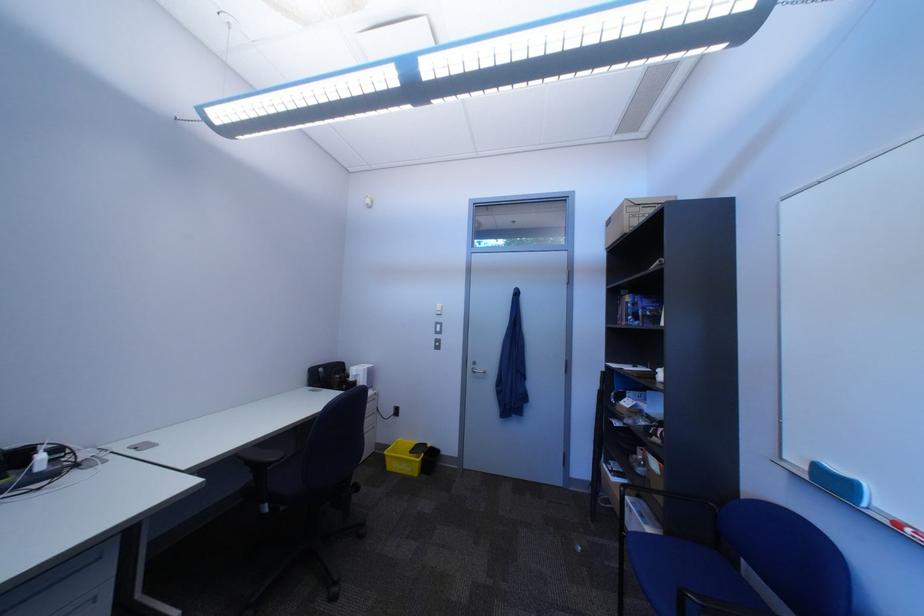
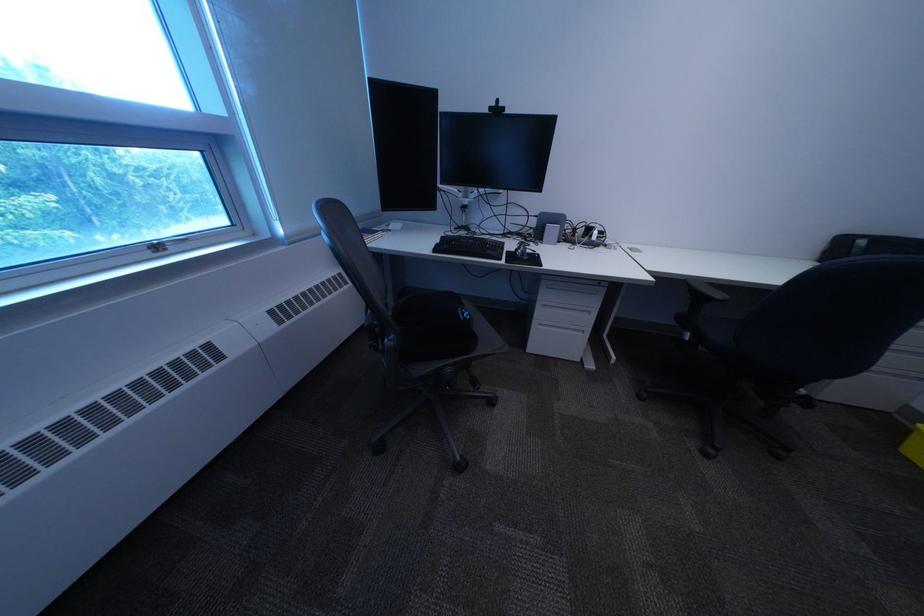
The point at (x=282, y=506) is marked in the first image. Where is the corresponding point in the second image?

(704, 336)